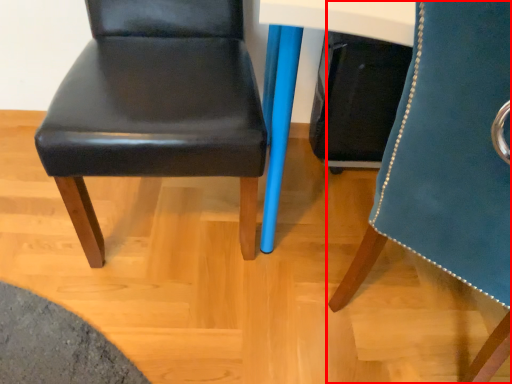
Question: Considering the relative positions of chair (annotated by the red box) and chair in the image provided, where is chair (annotated by the red box) located with respect to the staircase?

Choices:
 (A) right
 (B) left

Answer: (A)